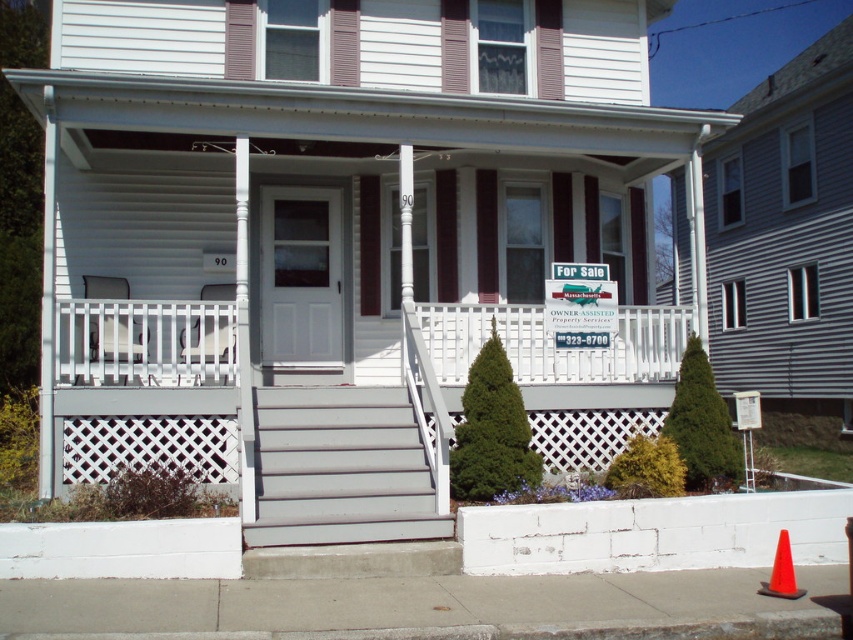
You are a real estate agent who wants to place a new sign on the porch. The new sign must be larger than the existing white plastic sign at center. Can you place it on the white painted wood porch at center without overlapping the existing sign?

The white painted wood porch at center has a smaller size compared to white plastic sign at center. Since the new sign must be larger than the existing white plastic sign at center, it would not fit on the white painted wood porch at center due to its limited space.

From the picture: You are a delivery person trying to park your van near the house. The van is 2 meters wide. There is a white painted wood porch at center and an orange plastic traffic cone at lower right. Can you park between them without hitting either?

The white painted wood porch at center is thinner than orange plastic traffic cone at lower right. Since the van is 2 meters wide, and the space between them depends on their widths, but the description only states the porch is thinner than the cone, we cannot determine if the total space is sufficient. More information is needed.